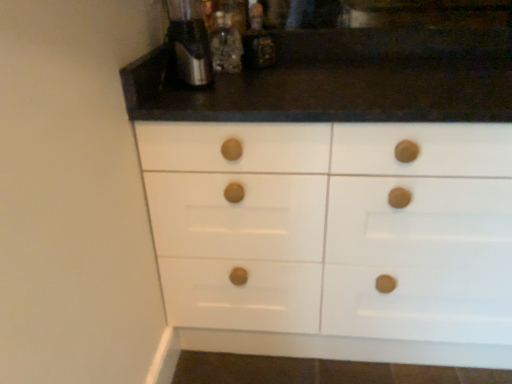
Identify the location of translucent glass bottle at upper center, which is the second bottle from right to left. Image resolution: width=512 pixels, height=384 pixels. (225, 44).

How much space does metallic silver bottle at upper center, acting as the second bottle starting from the left, occupy vertically?

It is 7.55 inches.

Image resolution: width=512 pixels, height=384 pixels. Describe the element at coordinates (190, 42) in the screenshot. I see `satin silver coffee machine at upper center` at that location.

The height and width of the screenshot is (384, 512). I want to click on translucent glass bottle at upper center, the first bottle when ordered from left to right, so click(x=225, y=44).

Is metallic silver bottle at upper center, the first bottle when ordered from right to left, thinner than translucent glass bottle at upper center, which is the second bottle from right to left?

Correct, the width of metallic silver bottle at upper center, the first bottle when ordered from right to left, is less than that of translucent glass bottle at upper center, which is the second bottle from right to left.

Looking at this image, between metallic silver bottle at upper center, acting as the second bottle starting from the left, and translucent glass bottle at upper center, the first bottle when ordered from left to right, which one has smaller size?

translucent glass bottle at upper center, the first bottle when ordered from left to right.

Find the location of a particular element. bottle below the metallic silver bottle at upper center, the first bottle when ordered from right to left (from a real-world perspective) is located at coordinates (225, 44).

Who is shorter, metallic silver bottle at upper center, the first bottle when ordered from right to left, or translucent glass bottle at upper center, which is the second bottle from right to left?

Standing shorter between the two is translucent glass bottle at upper center, which is the second bottle from right to left.

Do you think satin silver coffee machine at upper center is within metallic silver bottle at upper center, acting as the second bottle starting from the left, or outside of it?

satin silver coffee machine at upper center lies outside metallic silver bottle at upper center, acting as the second bottle starting from the left.

Does satin silver coffee machine at upper center have a smaller size compared to metallic silver bottle at upper center, acting as the second bottle starting from the left?

Incorrect, satin silver coffee machine at upper center is not smaller in size than metallic silver bottle at upper center, acting as the second bottle starting from the left.

Considering the relative sizes of satin silver coffee machine at upper center and metallic silver bottle at upper center, the first bottle when ordered from right to left, in the image provided, is satin silver coffee machine at upper center thinner than metallic silver bottle at upper center, the first bottle when ordered from right to left,?

Incorrect, the width of satin silver coffee machine at upper center is not less than that of metallic silver bottle at upper center, the first bottle when ordered from right to left.

Between translucent glass bottle at upper center, which is the second bottle from right to left, and metallic silver bottle at upper center, the first bottle when ordered from right to left, which one has smaller width?

Thinner between the two is metallic silver bottle at upper center, the first bottle when ordered from right to left.

Who is taller, translucent glass bottle at upper center, which is the second bottle from right to left, or metallic silver bottle at upper center, acting as the second bottle starting from the left?

metallic silver bottle at upper center, acting as the second bottle starting from the left.

Between point (239, 68) and point (247, 66), which one is positioned behind?

The point (239, 68) is farther.

The height and width of the screenshot is (384, 512). What are the coordinates of `bottle below the metallic silver bottle at upper center, acting as the second bottle starting from the left (from a real-world perspective)` in the screenshot? It's located at (225, 44).

From the image's perspective, is metallic silver bottle at upper center, the first bottle when ordered from right to left, located beneath satin silver coffee machine at upper center?

No.

Does point (255, 29) lie in front of point (170, 8)?

No, (255, 29) is behind (170, 8).

From a real-world perspective, is metallic silver bottle at upper center, the first bottle when ordered from right to left, positioned over satin silver coffee machine at upper center based on gravity?

No.

Does metallic silver bottle at upper center, acting as the second bottle starting from the left, have a larger size compared to satin silver coffee machine at upper center?

Incorrect, metallic silver bottle at upper center, acting as the second bottle starting from the left, is not larger than satin silver coffee machine at upper center.

How many degrees apart are the facing directions of satin silver coffee machine at upper center and translucent glass bottle at upper center, which is the second bottle from right to left?

The facing directions of satin silver coffee machine at upper center and translucent glass bottle at upper center, which is the second bottle from right to left, are 7.23 degrees apart.

Is satin silver coffee machine at upper center to the left of translucent glass bottle at upper center, which is the second bottle from right to left, from the viewer's perspective?

Yes.

Considering the points (184, 31) and (217, 25), which point is behind, point (184, 31) or point (217, 25)?

The point (217, 25) is behind.

Is satin silver coffee machine at upper center oriented towards translucent glass bottle at upper center, the first bottle when ordered from left to right?

No, satin silver coffee machine at upper center does not turn towards translucent glass bottle at upper center, the first bottle when ordered from left to right.

From a real-world perspective, is translucent glass bottle at upper center, the first bottle when ordered from left to right, located higher than satin silver coffee machine at upper center?

No.

Based on the photo, is translucent glass bottle at upper center, the first bottle when ordered from left to right, placed right next to satin silver coffee machine at upper center?

No.

Is translucent glass bottle at upper center, the first bottle when ordered from left to right, spatially inside satin silver coffee machine at upper center, or outside of it?

translucent glass bottle at upper center, the first bottle when ordered from left to right, is located beyond the bounds of satin silver coffee machine at upper center.

The height and width of the screenshot is (384, 512). Find the location of `bottle on the right of translucent glass bottle at upper center, which is the second bottle from right to left`. bottle on the right of translucent glass bottle at upper center, which is the second bottle from right to left is located at coordinates (258, 41).

Where is `the 2nd bottle behind the satin silver coffee machine at upper center, starting your count from the anchor`? This screenshot has width=512, height=384. the 2nd bottle behind the satin silver coffee machine at upper center, starting your count from the anchor is located at coordinates (258, 41).

From the image, which object appears to be farther from translucent glass bottle at upper center, which is the second bottle from right to left, metallic silver bottle at upper center, acting as the second bottle starting from the left, or satin silver coffee machine at upper center?

satin silver coffee machine at upper center.

Considering their positions, is satin silver coffee machine at upper center positioned further to translucent glass bottle at upper center, which is the second bottle from right to left, than metallic silver bottle at upper center, acting as the second bottle starting from the left?

Among the two, satin silver coffee machine at upper center is located further to translucent glass bottle at upper center, which is the second bottle from right to left.

When comparing their distances from satin silver coffee machine at upper center, does translucent glass bottle at upper center, the first bottle when ordered from left to right, or metallic silver bottle at upper center, the first bottle when ordered from right to left, seem closer?

translucent glass bottle at upper center, the first bottle when ordered from left to right, is closer to satin silver coffee machine at upper center.

From the image, which object appears to be farther from satin silver coffee machine at upper center, metallic silver bottle at upper center, acting as the second bottle starting from the left, or translucent glass bottle at upper center, the first bottle when ordered from left to right?

The object further to satin silver coffee machine at upper center is metallic silver bottle at upper center, acting as the second bottle starting from the left.

When comparing their distances from metallic silver bottle at upper center, the first bottle when ordered from right to left, does translucent glass bottle at upper center, the first bottle when ordered from left to right, or satin silver coffee machine at upper center seem further?

The object further to metallic silver bottle at upper center, the first bottle when ordered from right to left, is satin silver coffee machine at upper center.

Based on their spatial positions, is satin silver coffee machine at upper center or translucent glass bottle at upper center, which is the second bottle from right to left, closer to metallic silver bottle at upper center, the first bottle when ordered from right to left?

translucent glass bottle at upper center, which is the second bottle from right to left.

Identify the location of bottle between satin silver coffee machine at upper center and metallic silver bottle at upper center, the first bottle when ordered from right to left, in the front-back direction. (225, 44).